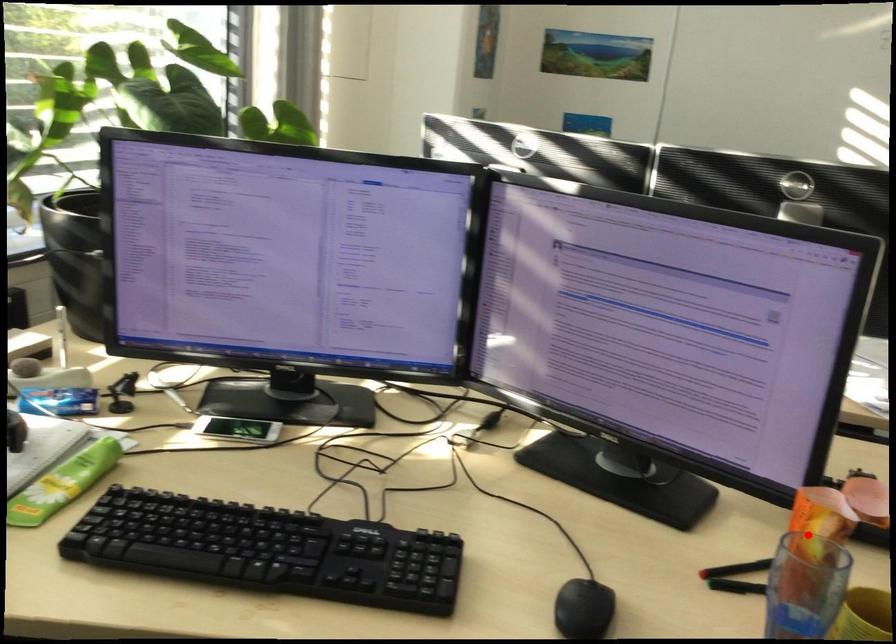
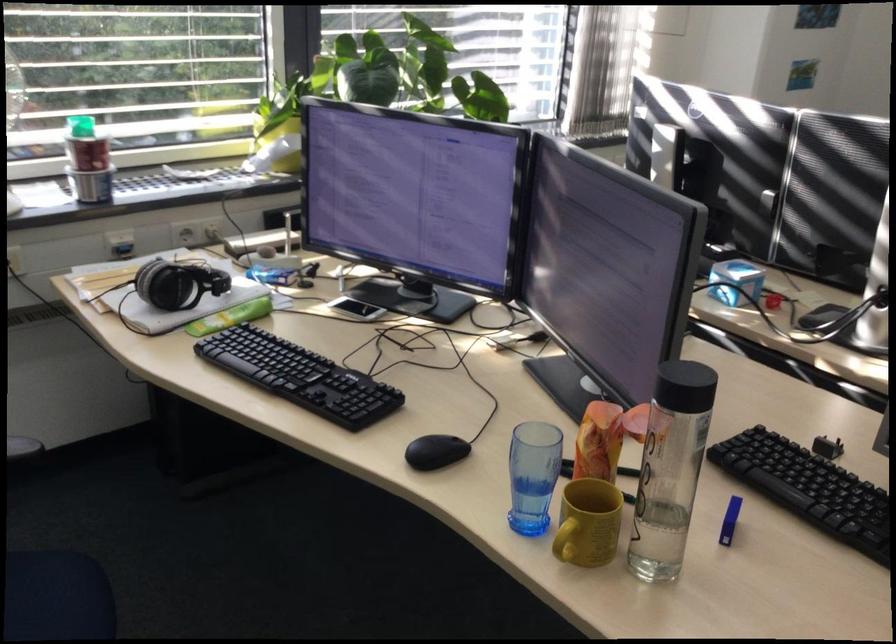
The point at the highlighted location is marked in the first image. Where is the corresponding point in the second image?

(599, 442)